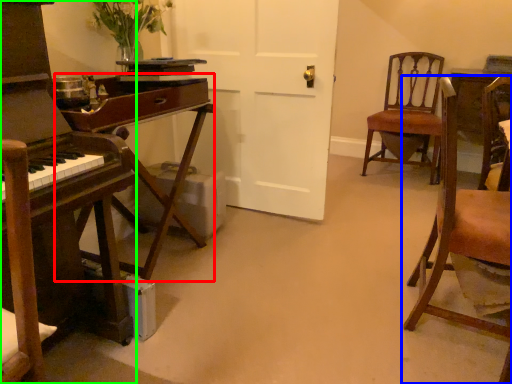
Question: Which is farther away from table (highlighted by a red box)? chair (highlighted by a blue box) or desk (highlighted by a green box)?

Choices:
 (A) chair
 (B) desk

Answer: (A)